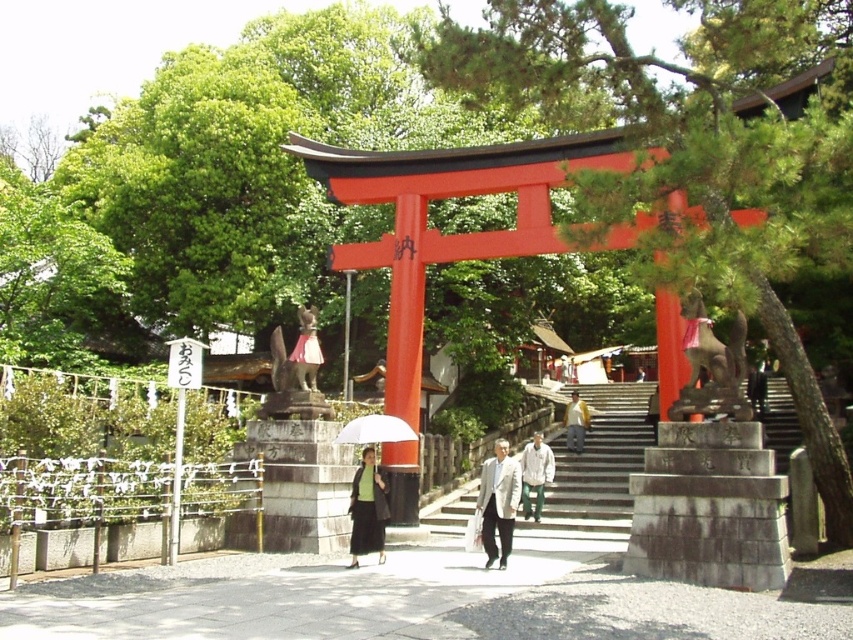
Does light gray fabric jacket at center have a larger size compared to light brown leather jacket at center?

Correct, light gray fabric jacket at center is larger in size than light brown leather jacket at center.

Who is more distant from viewer, (523, 508) or (585, 403)?

The point (585, 403) is behind.

Does point (524, 467) come in front of point (572, 408)?

Yes.

This screenshot has height=640, width=853. Identify the location of light gray fabric jacket at center. tap(535, 474).

Who is more forward, [489,560] or [383,424]?

Point [489,560] is in front.

What do you see at coordinates (498, 502) in the screenshot? This screenshot has width=853, height=640. I see `light beige suit at center` at bounding box center [498, 502].

The height and width of the screenshot is (640, 853). Identify the location of light beige suit at center. coord(498,502).

The height and width of the screenshot is (640, 853). What do you see at coordinates (498, 502) in the screenshot?
I see `light beige suit at center` at bounding box center [498, 502].

Can you confirm if light beige suit at center is bigger than light brown leather jacket at center?

Yes, light beige suit at center is bigger than light brown leather jacket at center.

What do you see at coordinates (498, 502) in the screenshot? I see `light beige suit at center` at bounding box center [498, 502].

Locate an element on the screen. The height and width of the screenshot is (640, 853). light beige suit at center is located at coordinates (498, 502).